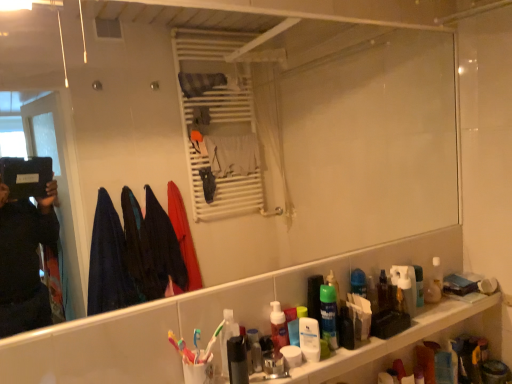
Question: Is green matte mouthwash at right, the 4th mouthwash from the back, oriented towards multicolored plastic toothbrush at lower center, acting as the first toothbrush starting from the left?

Choices:
 (A) yes
 (B) no

Answer: (B)

Question: Is green matte mouthwash at right, the 4th mouthwash from the back, far from multicolored plastic toothbrush at lower center, acting as the first toothbrush starting from the left?

Choices:
 (A) yes
 (B) no

Answer: (B)

Question: Does green matte mouthwash at right, the 4th mouthwash positioned from the right, have a lesser height compared to multicolored plastic toothbrush at lower center, acting as the first toothbrush starting from the left?

Choices:
 (A) yes
 (B) no

Answer: (B)

Question: Is green matte mouthwash at right, the 4th mouthwash from the back, behind multicolored plastic toothbrush at lower center, acting as the first toothbrush starting from the left?

Choices:
 (A) yes
 (B) no

Answer: (A)

Question: From the image's perspective, is green matte mouthwash at right, which is the 4th mouthwash from left to right, under multicolored plastic toothbrush at lower center, placed as the 2th toothbrush when sorted from right to left?

Choices:
 (A) no
 (B) yes

Answer: (A)

Question: Does green matte mouthwash at right, which appears as the 4th mouthwash when viewed from the front, have a lesser width compared to multicolored plastic toothbrush at lower center, placed as the 2th toothbrush when sorted from right to left?

Choices:
 (A) yes
 (B) no

Answer: (B)

Question: Is brown plastic bottle at lower right, the third mouthwash positioned from the right, completely or partially outside of white matte toothpaste at center?

Choices:
 (A) no
 (B) yes

Answer: (B)

Question: Considering the relative sizes of brown plastic bottle at lower right, marked as the third mouthwash in a back-to-front arrangement, and white matte toothpaste at center in the image provided, is brown plastic bottle at lower right, marked as the third mouthwash in a back-to-front arrangement, bigger than white matte toothpaste at center?

Choices:
 (A) yes
 (B) no

Answer: (B)

Question: Is brown plastic bottle at lower right, marked as the third mouthwash in a back-to-front arrangement, wider than white matte toothpaste at center?

Choices:
 (A) yes
 (B) no

Answer: (B)

Question: Could you tell me if brown plastic bottle at lower right, the third mouthwash positioned from the right, is turned towards white matte toothpaste at center?

Choices:
 (A) no
 (B) yes

Answer: (A)

Question: Can you confirm if brown plastic bottle at lower right, the 5th mouthwash from the left, is positioned to the left of white matte toothpaste at center?

Choices:
 (A) yes
 (B) no

Answer: (B)

Question: Is brown plastic bottle at lower right, marked as the third mouthwash in a back-to-front arrangement, not close to white matte toothpaste at center?

Choices:
 (A) yes
 (B) no

Answer: (B)

Question: Is white matte toothpaste at center taller than translucent plastic shelf at lower right?

Choices:
 (A) yes
 (B) no

Answer: (A)